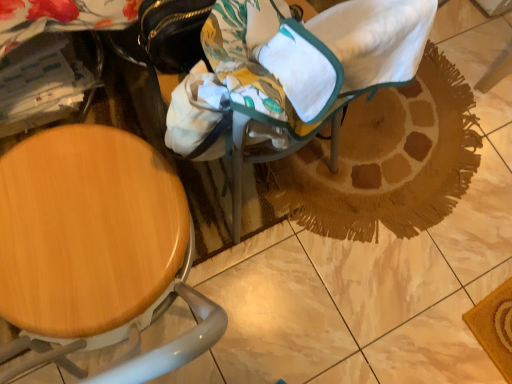
Where is `vacant space in front of brown woven mat at center`? vacant space in front of brown woven mat at center is located at coordinates (351, 312).